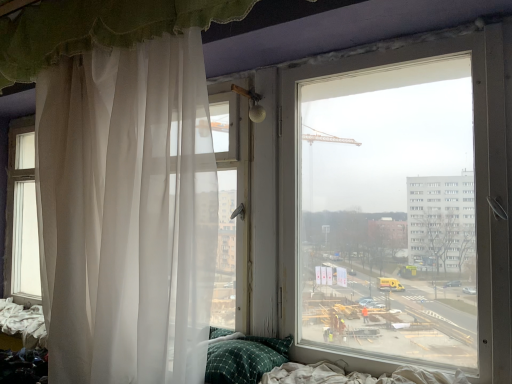
Question: Is green checkered pillow at lower center taller than white sheer curtain at upper left, the first curtain positioned from the top?

Choices:
 (A) no
 (B) yes

Answer: (A)

Question: Considering the relative sizes of green checkered pillow at lower center and white sheer curtain at upper left, the first curtain positioned from the top, in the image provided, is green checkered pillow at lower center bigger than white sheer curtain at upper left, the first curtain positioned from the top,?

Choices:
 (A) yes
 (B) no

Answer: (B)

Question: Is green checkered pillow at lower center located outside white sheer curtain at upper left, the second curtain from the bottom?

Choices:
 (A) no
 (B) yes

Answer: (B)

Question: Is green checkered pillow at lower center to the left of white sheer curtain at upper left, the second curtain from the bottom, from the viewer's perspective?

Choices:
 (A) yes
 (B) no

Answer: (B)

Question: Can you confirm if green checkered pillow at lower center is shorter than white sheer curtain at upper left, the first curtain positioned from the top?

Choices:
 (A) no
 (B) yes

Answer: (B)

Question: From their relative heights in the image, would you say white sheer curtain at left, marked as the second curtain in a top-to-bottom arrangement, is taller or shorter than green checkered pillow at lower center?

Choices:
 (A) short
 (B) tall

Answer: (B)

Question: In terms of size, does white sheer curtain at left, positioned as the 1th curtain in bottom-to-top order, appear bigger or smaller than green checkered pillow at lower center?

Choices:
 (A) big
 (B) small

Answer: (A)

Question: Is white sheer curtain at left, marked as the second curtain in a top-to-bottom arrangement, inside or outside of green checkered pillow at lower center?

Choices:
 (A) inside
 (B) outside

Answer: (B)

Question: Looking at their shapes, would you say white sheer curtain at left, marked as the second curtain in a top-to-bottom arrangement, is wider or thinner than green checkered pillow at lower center?

Choices:
 (A) thin
 (B) wide

Answer: (B)

Question: From the image's perspective, relative to white sheer curtain at upper left, the second curtain from the bottom, is green checkered pillow at lower center above or below?

Choices:
 (A) below
 (B) above

Answer: (A)

Question: Visually, is green checkered pillow at lower center positioned to the left or to the right of white sheer curtain at upper left, the second curtain from the bottom?

Choices:
 (A) left
 (B) right

Answer: (B)

Question: Do you think green checkered pillow at lower center is within white sheer curtain at upper left, the second curtain from the bottom, or outside of it?

Choices:
 (A) inside
 (B) outside

Answer: (B)

Question: Considering the positions of point [215, 336] and point [81, 23], is point [215, 336] closer or farther from the camera than point [81, 23]?

Choices:
 (A) closer
 (B) farther

Answer: (B)

Question: Is white sheer curtain at left, positioned as the 1th curtain in bottom-to-top order, in front of or behind white sheer curtain at upper left, the first curtain positioned from the top, in the image?

Choices:
 (A) behind
 (B) front

Answer: (A)

Question: In terms of size, does white sheer curtain at left, positioned as the 1th curtain in bottom-to-top order, appear bigger or smaller than white sheer curtain at upper left, the first curtain positioned from the top?

Choices:
 (A) big
 (B) small

Answer: (A)